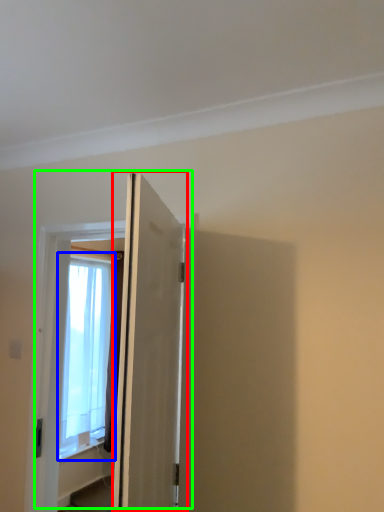
Question: Which object is positioned farthest from door (highlighted by a red box)? Select from window (highlighted by a blue box) and door (highlighted by a green box).

Choices:
 (A) window
 (B) door

Answer: (A)